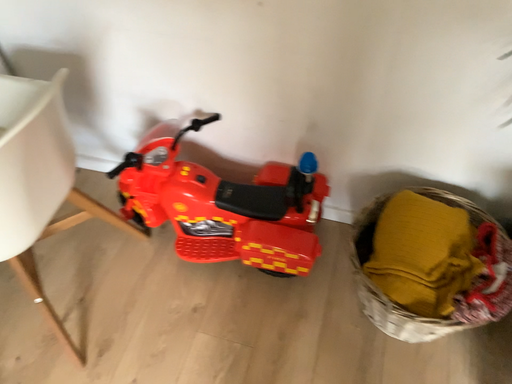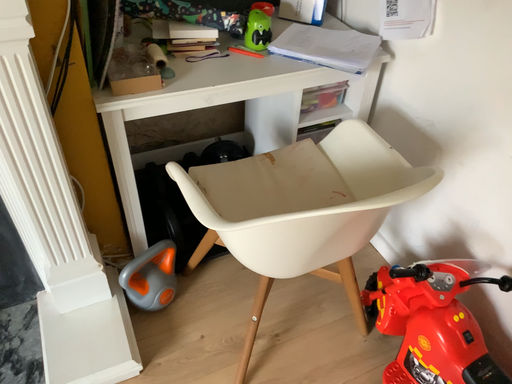
Question: How did the camera likely rotate when shooting the video?

Choices:
 (A) rotated downward
 (B) rotated upward

Answer: (B)